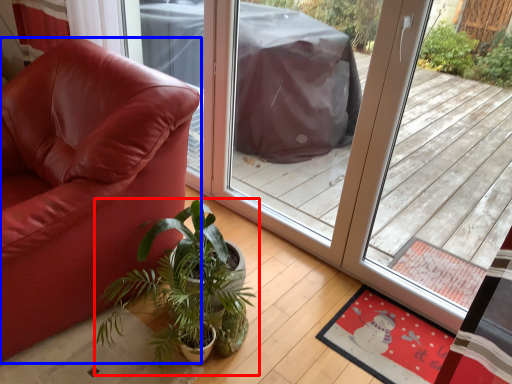
Question: Among these objects, which one is nearest to the camera, houseplant (highlighted by a red box) or chair (highlighted by a blue box)?

Choices:
 (A) houseplant
 (B) chair

Answer: (B)